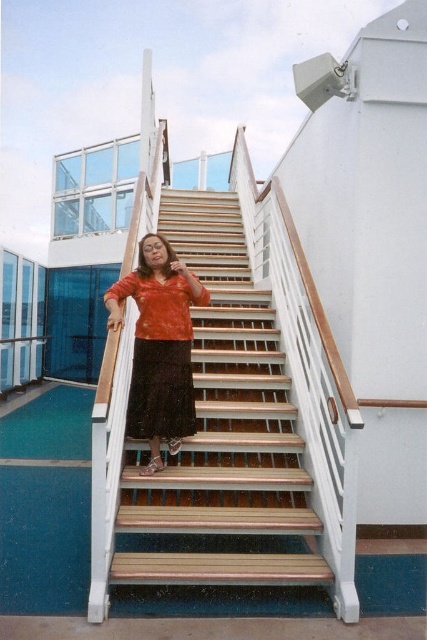
Question: Which object is farther from the camera taking this photo?

Choices:
 (A) wooden stairs at center
 (B) matte orange blouse at center

Answer: (B)

Question: Which object appears farthest from the camera in this image?

Choices:
 (A) wooden stairs at center
 (B) matte orange blouse at center

Answer: (B)

Question: Can you confirm if wooden stairs at center is smaller than matte orange blouse at center?

Choices:
 (A) yes
 (B) no

Answer: (B)

Question: Which object appears farthest from the camera in this image?

Choices:
 (A) wooden stairs at center
 (B) matte orange blouse at center

Answer: (B)

Question: Does wooden stairs at center have a greater width compared to matte orange blouse at center?

Choices:
 (A) yes
 (B) no

Answer: (A)

Question: From the image, what is the correct spatial relationship of wooden stairs at center in relation to matte orange blouse at center?

Choices:
 (A) above
 (B) below

Answer: (B)